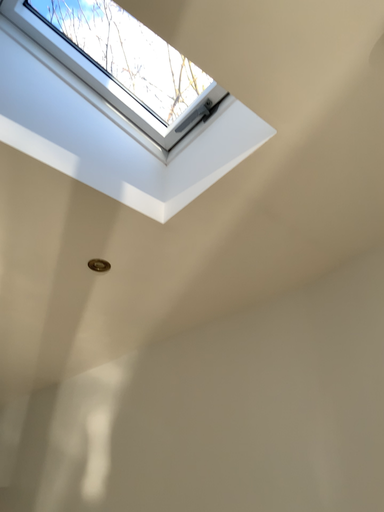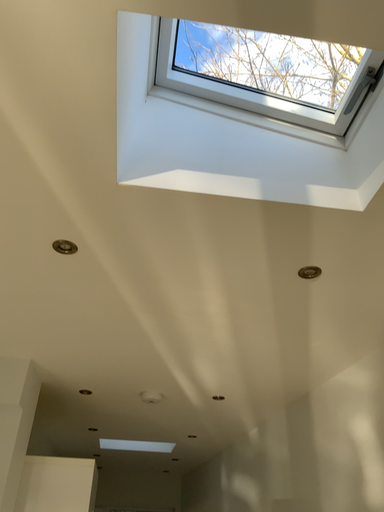
Question: Which way did the camera rotate in the video?

Choices:
 (A) rotated left
 (B) rotated right

Answer: (A)